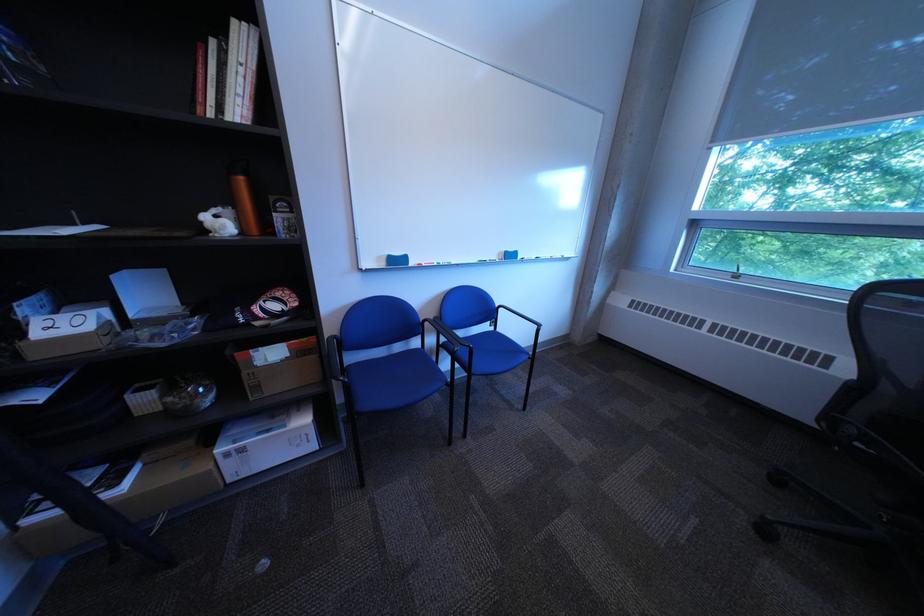
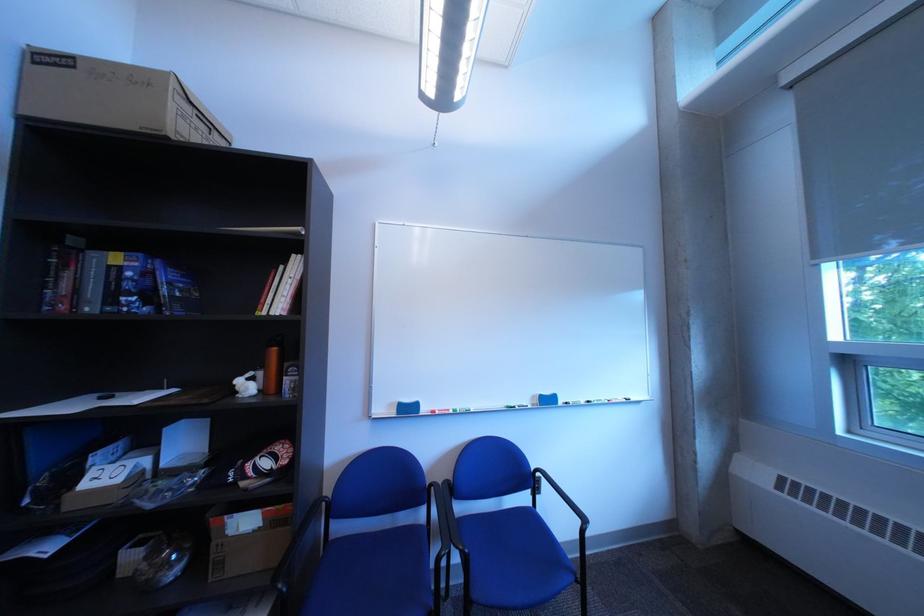
Locate, in the second image, the point that corresponds to (x=487, y=347) in the first image.

(482, 553)